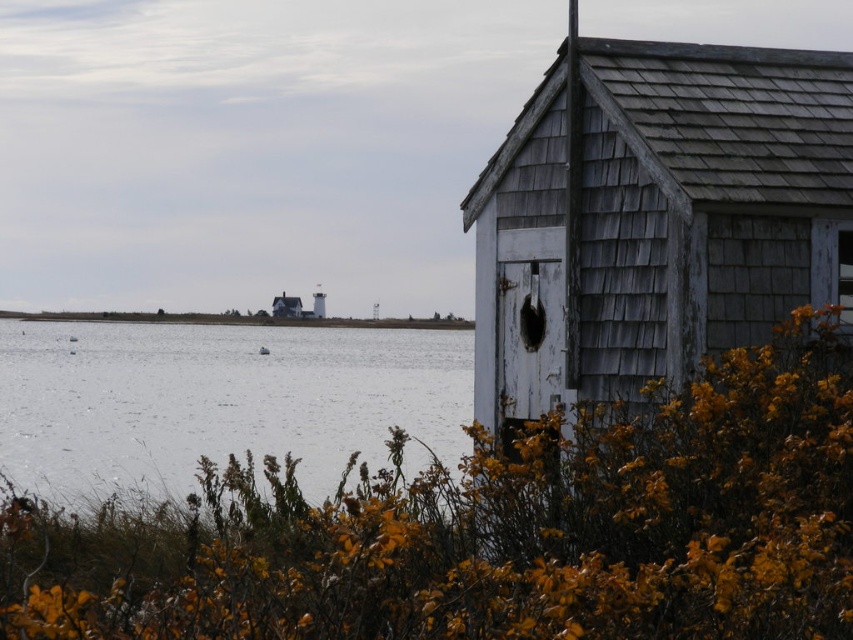
You are a photographer trying to capture the weathered wood hut at right and the white water at center in a single shot. Which object should you focus on first if you want to ensure both are in frame?

The weathered wood hut at right is taller than the white water at center, so you should focus on the weathered wood hut at right first to ensure both are in frame.

You are standing at the center of the image and want to locate the weathered wood hut at right. According to the coordinates provided, in which direction should you look to find it?

The weathered wood hut at right is located at coordinates point (654, 216), which means it is positioned to the lower right of the image. Therefore, you should look towards the lower right direction to find it.

You are standing at the edge of the water and see the point marked at coordinates (654, 216). Which object in the scene is that point located on?

The point marked at coordinates (654, 216) is located on the weathered wood hut at right.